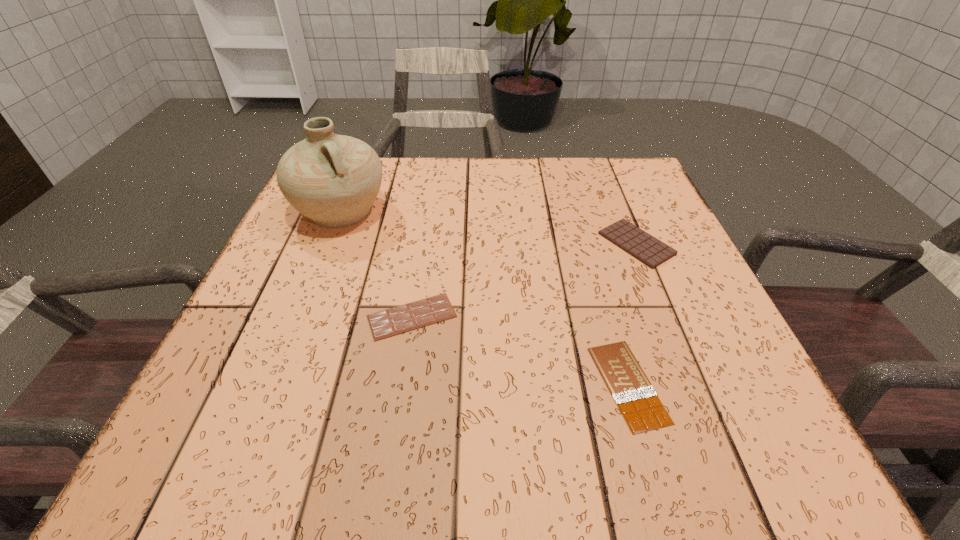
You are a GUI agent. You are given a task and a screenshot of the screen. Output one action in this format:
    pyautogui.click(x=<x>, y=<y>)
    Task: Click on the tallest object
    
    Given the screenshot: What is the action you would take?
    coord(332,179)

Find the location of a particular element. The height and width of the screenshot is (540, 960). the leftmost object is located at coordinates (332, 179).

You are a GUI agent. You are given a task and a screenshot of the screen. Output one action in this format:
    pyautogui.click(x=<x>, y=<y>)
    Task: Click on the farthest chocolate bar
    Image resolution: width=960 pixels, height=540 pixels.
    Given the screenshot: What is the action you would take?
    pyautogui.click(x=649, y=250)

Identify the location of the second tallest object. (649, 250).

Image resolution: width=960 pixels, height=540 pixels. In order to click on the third tallest object in this screenshot , I will do `click(390, 322)`.

Where is `the second object from left to right`? the second object from left to right is located at coordinates (390, 322).

Locate an element on the screen. The height and width of the screenshot is (540, 960). the shortest chocolate bar is located at coordinates click(x=637, y=400).

Locate an element on the screen. the nearest chocolate bar is located at coordinates click(637, 400).

In order to click on blank area located on the right of the leftmost object in this screenshot , I will do `click(438, 211)`.

Find the location of a particular element. The height and width of the screenshot is (540, 960). vacant space situated on the left of the third shortest object is located at coordinates (433, 244).